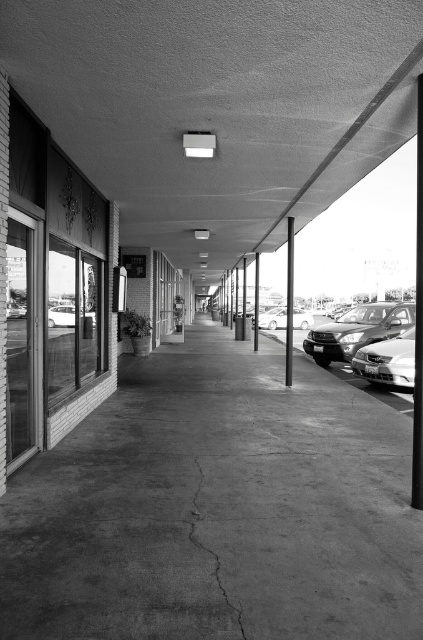
Does smooth concrete pillar at center appear under shiny silver sedan at center?

Incorrect, smooth concrete pillar at center is not positioned below shiny silver sedan at center.

From the picture: Does smooth concrete pillar at center appear over shiny silver sedan at center?

Indeed, smooth concrete pillar at center is positioned over shiny silver sedan at center.

Is point (288, 380) positioned after point (274, 312)?

No, it is not.

Find the location of `smooth concrete pillar at center`. smooth concrete pillar at center is located at coordinates pos(288,301).

Does shiny silver sedan at center-right appear on the right side of cracked concrete at center?

Correct, you'll find shiny silver sedan at center-right to the right of cracked concrete at center.

Who is more distant from viewer, [368,342] or [194,515]?

The point [368,342] is more distant.

Is point (348, 317) more distant than point (206, 509)?

Yes, point (348, 317) is farther from viewer.

The height and width of the screenshot is (640, 423). What are the coordinates of `shiny silver sedan at center-right` in the screenshot? It's located at (357, 330).

Is smooth concrete pillar at center shorter than metallic silver car at center?

Incorrect, smooth concrete pillar at center's height does not fall short of metallic silver car at center's.

Identify the location of smooth concrete pillar at center. The width and height of the screenshot is (423, 640). (288, 301).

Image resolution: width=423 pixels, height=640 pixels. Find the location of `smooth concrete pillar at center`. smooth concrete pillar at center is located at coordinates (288, 301).

I want to click on smooth concrete pillar at center, so click(x=288, y=301).